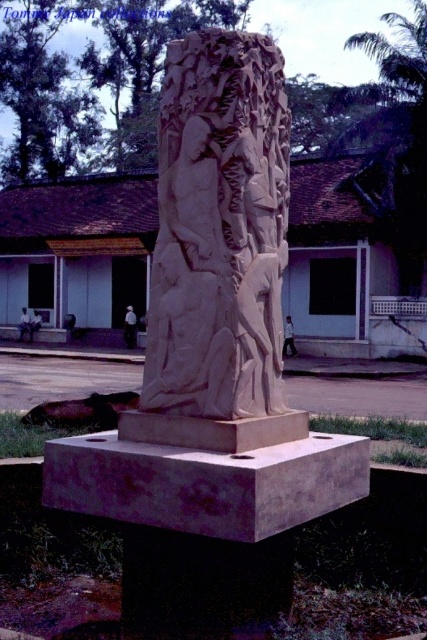
Question: Which of the following is the closest to the observer?

Choices:
 (A) sandstone sculpture at center
 (B) smooth stone sculpture at center

Answer: (B)

Question: Estimate the real-world distances between objects in this image. Which object is closer to the smooth stone sculpture at center?

Choices:
 (A) sandstone carving at center
 (B) sandstone sculpture at center

Answer: (B)

Question: Which object is closer to the camera taking this photo?

Choices:
 (A) sandstone carving at center
 (B) smooth stone sculpture at center

Answer: (B)

Question: Is sandstone sculpture at center to the left of smooth stone sculpture at center from the viewer's perspective?

Choices:
 (A) no
 (B) yes

Answer: (B)

Question: Where is sandstone carving at center located in relation to smooth stone sculpture at center in the image?

Choices:
 (A) below
 (B) above

Answer: (B)

Question: Does sandstone sculpture at center have a lesser width compared to smooth stone sculpture at center?

Choices:
 (A) yes
 (B) no

Answer: (A)